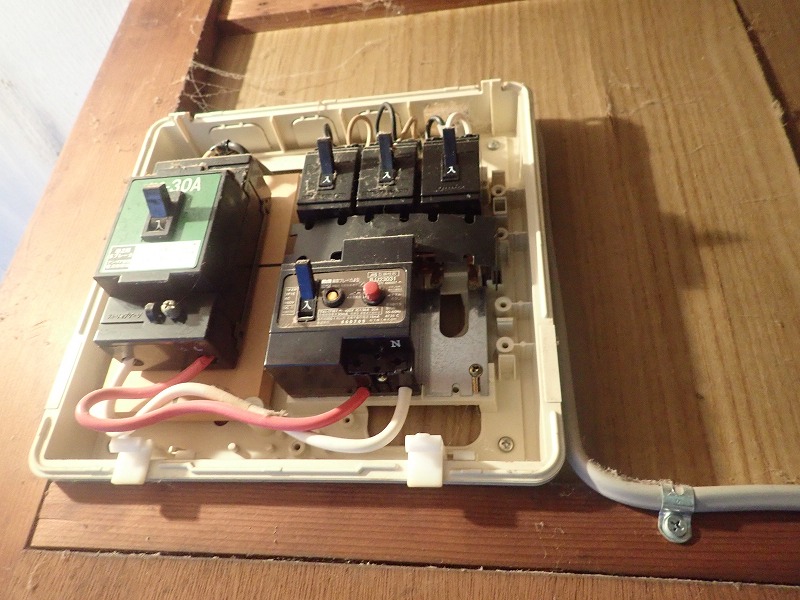
This screenshot has height=600, width=800. What are the coordinates of `switch` in the screenshot? It's located at (305, 280), (321, 158), (362, 164), (428, 158), (166, 193).